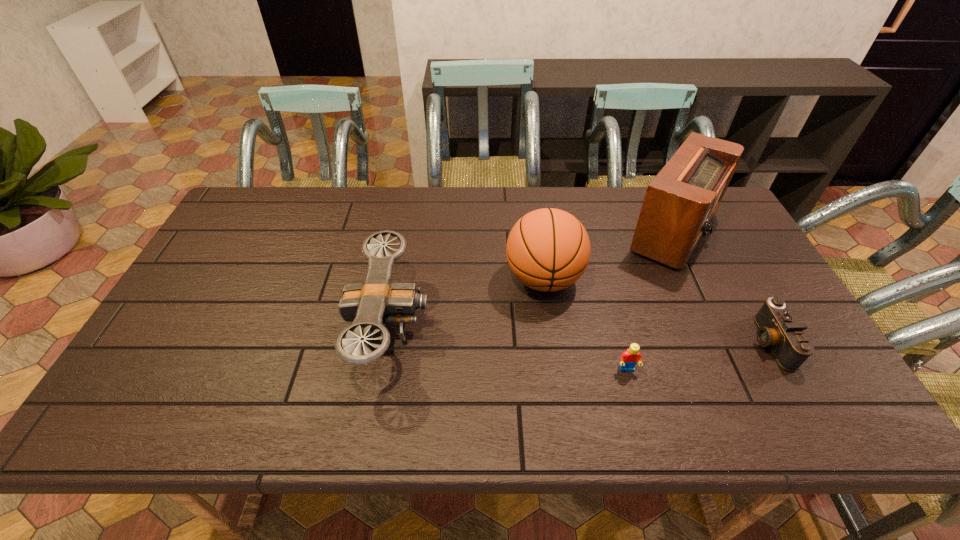
Where is `radio receiver`? The height and width of the screenshot is (540, 960). radio receiver is located at coordinates tap(680, 202).

Find the location of a particular element. The height and width of the screenshot is (540, 960). the fourth object from right to left is located at coordinates (548, 249).

This screenshot has height=540, width=960. I want to click on the leftmost object, so click(x=377, y=301).

The image size is (960, 540). What are the coordinates of `drone` in the screenshot? It's located at (377, 301).

At what (x,y) coordinates should I click in order to perform the action: click on Lego. Please return your answer as a coordinate pair (x, y). Image resolution: width=960 pixels, height=540 pixels. Looking at the image, I should click on (629, 358).

Where is `camera`? This screenshot has width=960, height=540. camera is located at coordinates (778, 329).

At what (x,y) coordinates should I click in order to perform the action: click on free space located on the front of the radio receiver. Please return your answer as a coordinate pair (x, y). Image resolution: width=960 pixels, height=540 pixels. Looking at the image, I should click on (706, 302).

This screenshot has width=960, height=540. What are the coordinates of `free space located 0.260m on the front of the basketball` in the screenshot? It's located at (560, 396).

The width and height of the screenshot is (960, 540). What are the coordinates of `free space located 0.180m on the front-facing side of the third tallest object` in the screenshot? It's located at (499, 326).

Find the location of a particular element. The height and width of the screenshot is (540, 960). vacant space located on the face of the third object from left to right is located at coordinates (642, 427).